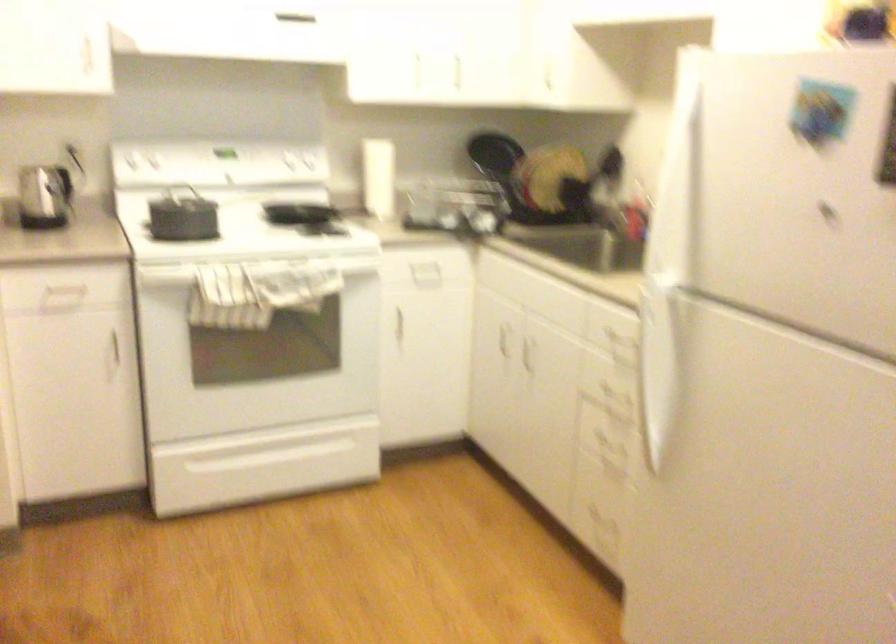
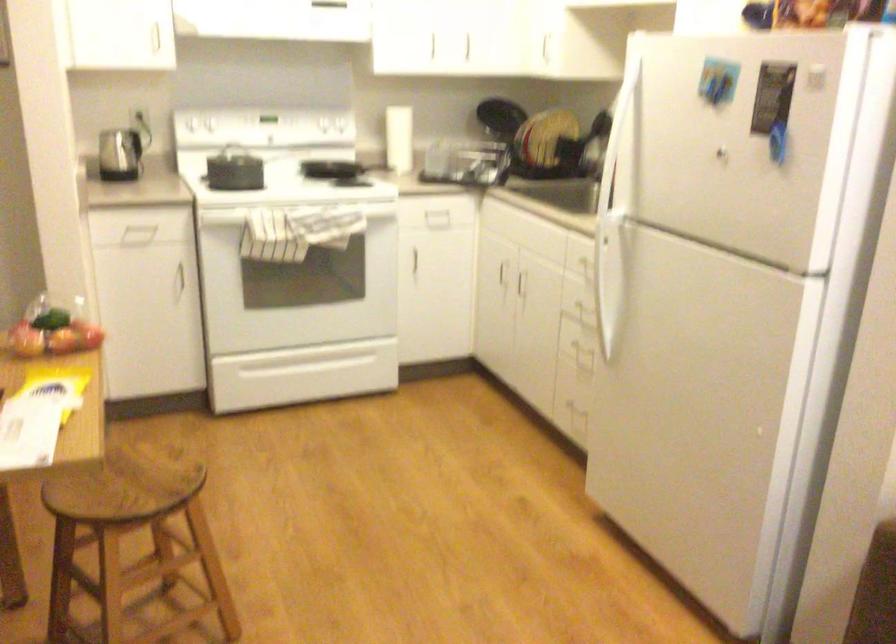
The point at (x=188, y=169) is marked in the first image. Where is the corresponding point in the second image?

(234, 125)